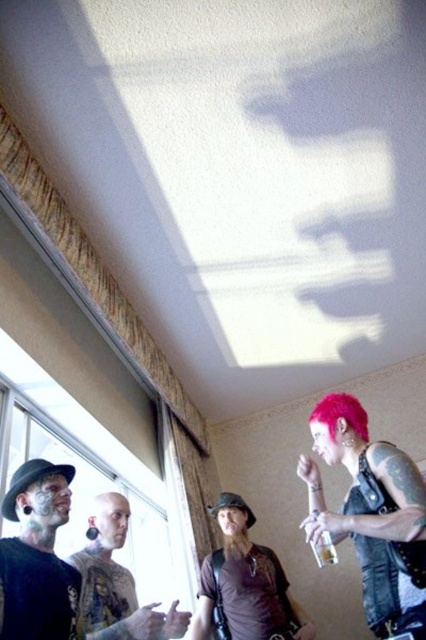
Question: Can you confirm if black leather hat at left is positioned to the right of pink matte hair at upper right?

Choices:
 (A) no
 (B) yes

Answer: (A)

Question: Can you confirm if black leather hat at left is positioned to the right of pink matte hair at upper right?

Choices:
 (A) yes
 (B) no

Answer: (B)

Question: Among these objects, which one is farthest from the camera?

Choices:
 (A) black tattooed skin at lower left
 (B) pink matte hair at upper right

Answer: (B)

Question: Can you confirm if black leather hat at left is thinner than black tattooed skin at lower left?

Choices:
 (A) yes
 (B) no

Answer: (A)

Question: Which point is closer to the camera?

Choices:
 (A) (325, 420)
 (B) (97, 605)
 (C) (20, 564)

Answer: (C)

Question: Estimate the real-world distances between objects in this image. Which object is farther from the pink matte hair at upper right?

Choices:
 (A) black tattooed skin at lower left
 (B) black leather hat at left

Answer: (A)